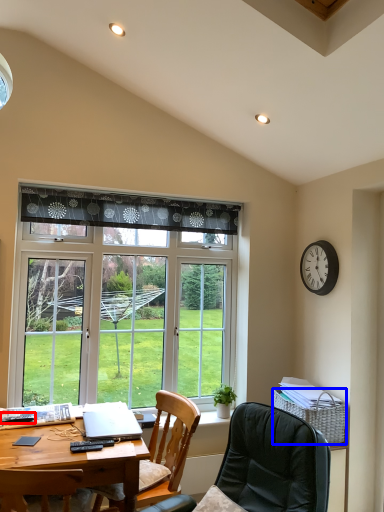
Question: Among these objects, which one is nearest to the camera, remote control (highlighted by a red box) or picnic basket (highlighted by a blue box)?

Choices:
 (A) remote control
 (B) picnic basket

Answer: (A)